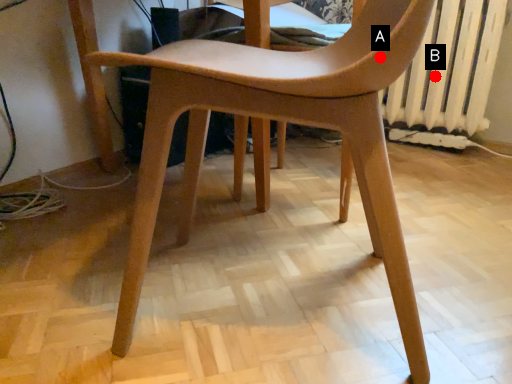
Question: Two points are circled on the image, labeled by A and B beside each circle. Which point is closer to the camera taking this photo?

Choices:
 (A) A is closer
 (B) B is closer

Answer: (A)